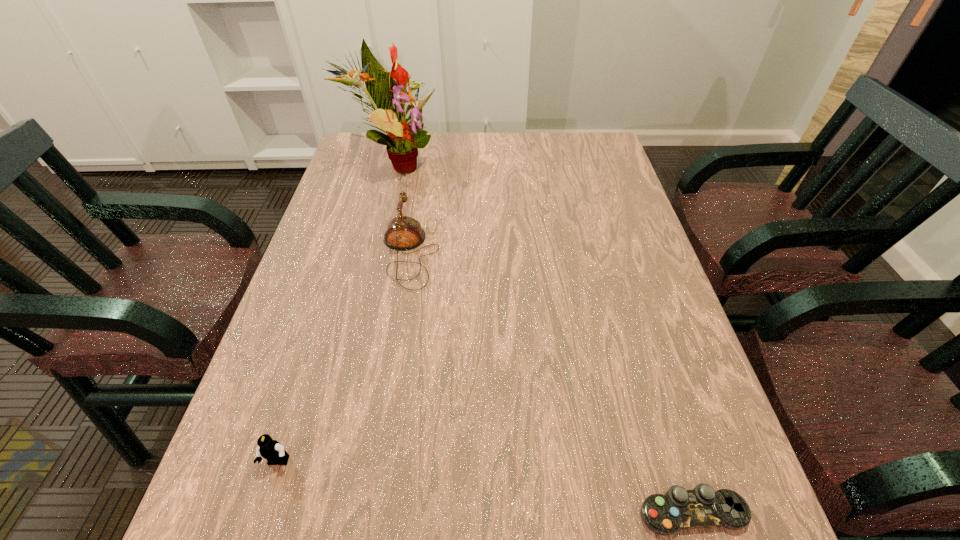
Find the location of a particular element. The height and width of the screenshot is (540, 960). vacant space at the left edge of the desktop is located at coordinates (274, 354).

Locate an element on the screen. The height and width of the screenshot is (540, 960). free space at the right edge is located at coordinates (634, 436).

The image size is (960, 540). I want to click on free space at the far right corner of the desktop, so click(572, 149).

Locate an element on the screen. The height and width of the screenshot is (540, 960). free space at the near right corner of the desktop is located at coordinates (732, 531).

Identify the location of free space between the third farthest object and the third shortest object. The width and height of the screenshot is (960, 540). (344, 358).

Locate an element on the screen. The image size is (960, 540). free point between the third farthest object and the second tallest object is located at coordinates (344, 358).

Identify the location of vacant area that lies between the farthest object and the rightmost object. (542, 338).

At what (x,y) coordinates should I click in order to perform the action: click on vacant point located between the control and the Lego. Please return your answer as a coordinate pair (x, y). Looking at the image, I should click on (485, 487).

You are a GUI agent. You are given a task and a screenshot of the screen. Output one action in this format:
    pyautogui.click(x=<x>, y=<y>)
    Task: Click on the vacant area that lies between the telephone and the Lego
    This screenshot has width=960, height=540.
    Given the screenshot: What is the action you would take?
    pyautogui.click(x=344, y=358)

You are a GUI agent. You are given a task and a screenshot of the screen. Output one action in this format:
    pyautogui.click(x=<x>, y=<y>)
    Task: Click on the unoccupied area between the Lego and the bouquet
    The image size is (960, 540).
    Given the screenshot: What is the action you would take?
    pyautogui.click(x=336, y=313)